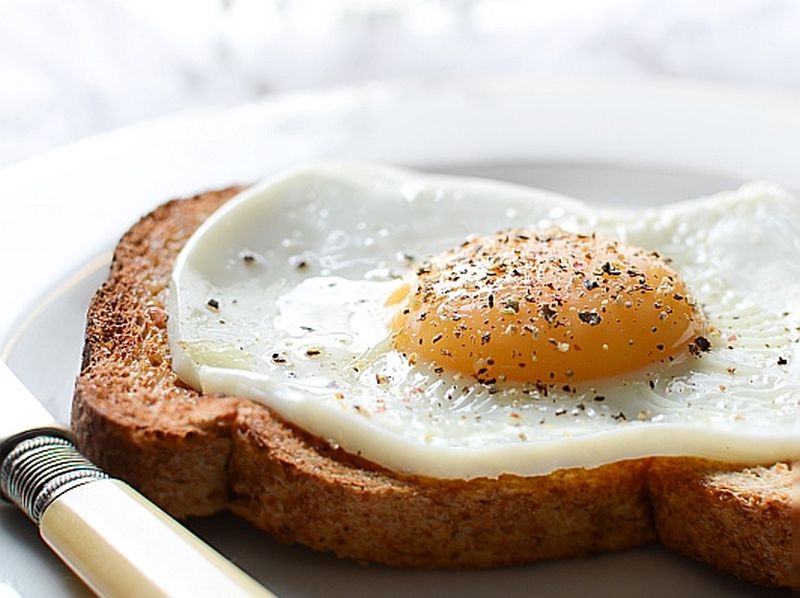
Find the location of a particular element. utensil is located at coordinates (30, 417).